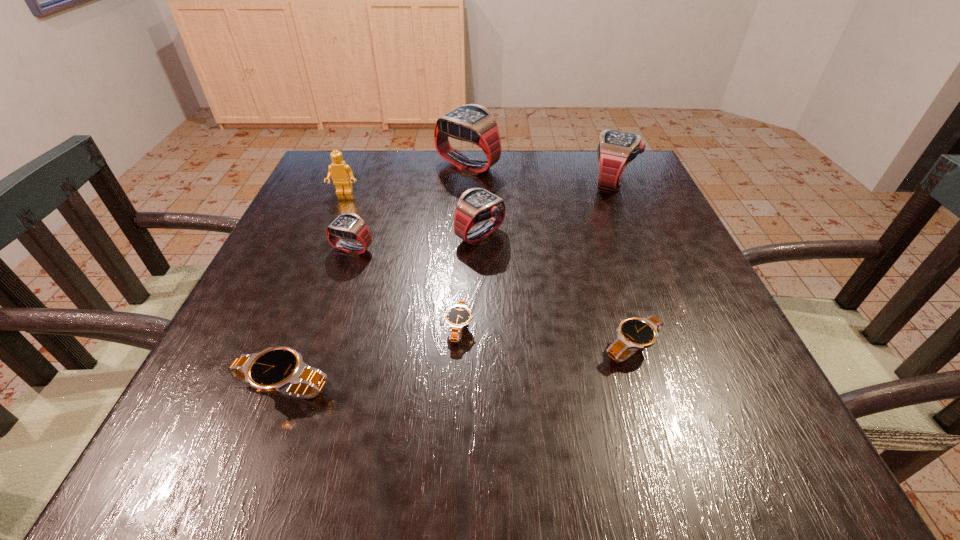
The height and width of the screenshot is (540, 960). Identify the location of unoccupied position between the fourth shortest object and the third shortest watch. (318, 318).

Select which object is the sixth closest to the smallest black watch. Please provide its 2D coordinates. Your answer should be formatted as a tuple, i.e. [(x, y)], where the tuple contains the x and y coordinates of a point satisfying the conditions above.

[(473, 123)]

I want to click on object that is the closest to the rightmost black watch, so click(x=458, y=316).

Locate which watch ranks fifth in proximity to the third biggest red watch. Please provide its 2D coordinates. Your answer should be formatted as a tuple, i.e. [(x, y)], where the tuple contains the x and y coordinates of a point satisfying the conditions above.

[(634, 333)]

Select which watch is the third closest to the second black watch from right to left. Please provide its 2D coordinates. Your answer should be formatted as a tuple, i.e. [(x, y)], where the tuple contains the x and y coordinates of a point satisfying the conditions above.

[(634, 333)]

Identify which red watch is the second closest to the smallest red watch. Please provide its 2D coordinates. Your answer should be formatted as a tuple, i.e. [(x, y)], where the tuple contains the x and y coordinates of a point satisfying the conditions above.

[(473, 123)]

Image resolution: width=960 pixels, height=540 pixels. I want to click on red watch that stands as the closest to the rightmost black watch, so click(475, 205).

Point out which black watch is positioned as the third nearest to the smallest red watch. Please provide its 2D coordinates. Your answer should be formatted as a tuple, i.e. [(x, y)], where the tuple contains the x and y coordinates of a point satisfying the conditions above.

[(634, 333)]

Identify which black watch is located as the nearest to the fifth tallest object. Please provide its 2D coordinates. Your answer should be formatted as a tuple, i.e. [(x, y)], where the tuple contains the x and y coordinates of a point satisfying the conditions above.

[(458, 316)]

Locate an element on the screen. Image resolution: width=960 pixels, height=540 pixels. vacant space that satisfies the following two spatial constraints: 1. on the face of the biggest black watch; 2. on the right side of the Lego is located at coordinates (264, 388).